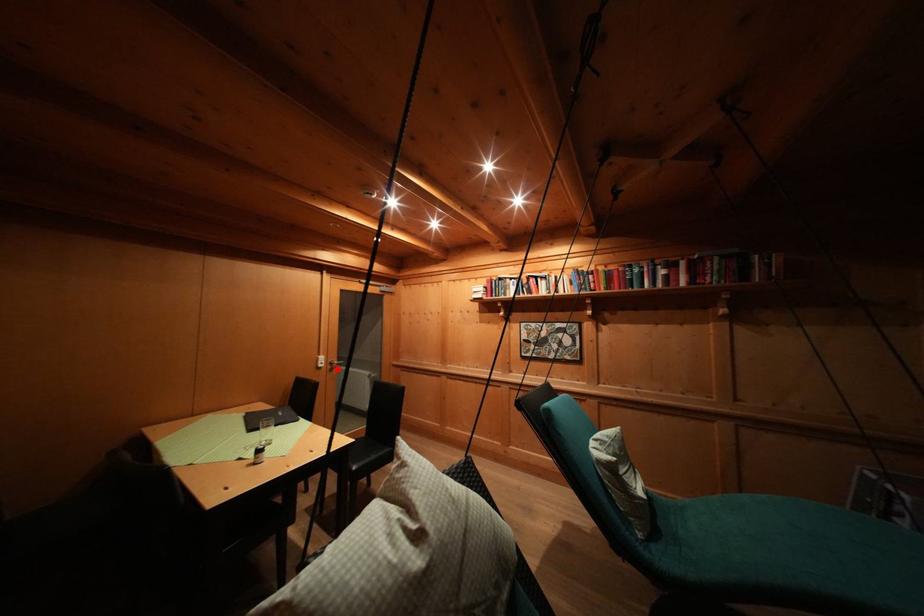
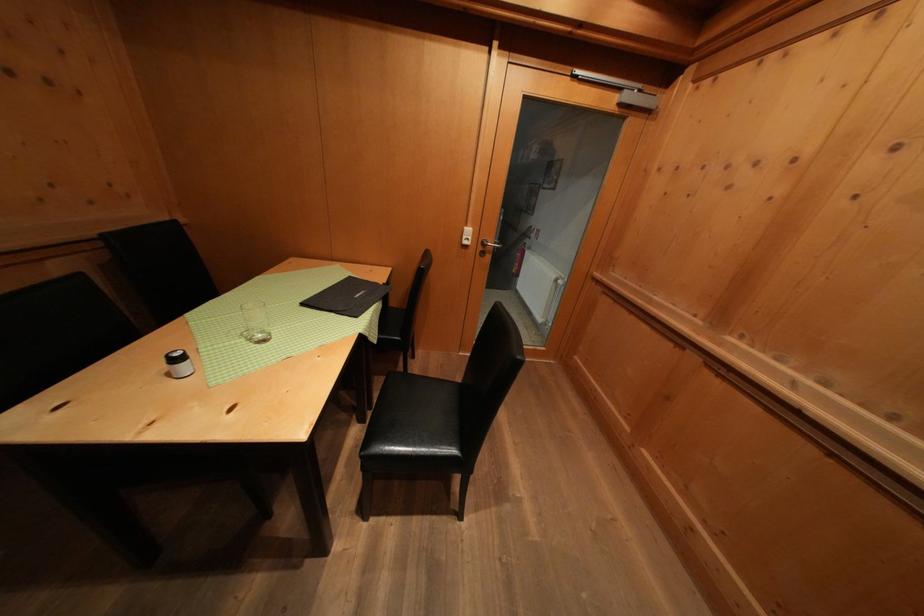
The point at the highlighted location is marked in the first image. Where is the corresponding point in the second image?

(490, 249)